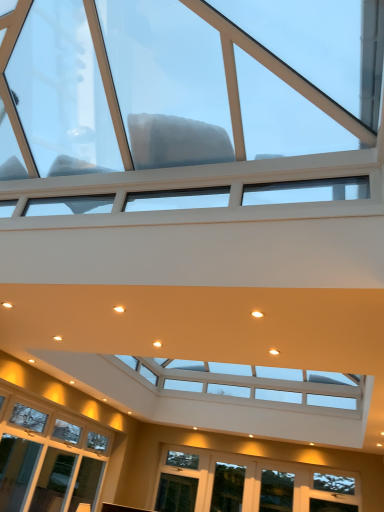
Question: Should I look upward or downward to see transparent glass window at upper center, which is counted as the 1th window, starting from the top?

Choices:
 (A) down
 (B) up

Answer: (B)

Question: Is transparent glass window at upper center, the third window from the back, positioned far away from clear glass window at lower center, which appears as the 2th window when ordered from the bottom?

Choices:
 (A) yes
 (B) no

Answer: (A)

Question: Is transparent glass window at upper center, the third window from the back, positioned with its back to clear glass window at lower center, which appears as the second window when viewed from the top?

Choices:
 (A) yes
 (B) no

Answer: (B)

Question: Does transparent glass window at upper center, which is counted as the 1th window, starting from the top, appear on the right side of clear glass window at lower center, the second window in the front-to-back sequence?

Choices:
 (A) no
 (B) yes

Answer: (A)

Question: Can you confirm if transparent glass window at upper center, which is counted as the 1th window, starting from the top, is bigger than clear glass window at lower center, which appears as the 2th window when ordered from the bottom?

Choices:
 (A) yes
 (B) no

Answer: (A)

Question: Is transparent glass window at upper center, which is counted as the 1th window, starting from the top, not inside clear glass window at lower center, the second window in the front-to-back sequence?

Choices:
 (A) yes
 (B) no

Answer: (A)

Question: Considering the relative sizes of transparent glass window at upper center, which is counted as the 1th window, starting from the top, and clear glass window at lower center, which appears as the 2th window when ordered from the bottom, in the image provided, is transparent glass window at upper center, which is counted as the 1th window, starting from the top, thinner than clear glass window at lower center, which appears as the 2th window when ordered from the bottom,?

Choices:
 (A) yes
 (B) no

Answer: (B)

Question: Can you confirm if clear glass window at lower center, which appears as the second window when viewed from the top, is positioned to the left of transparent glass window at upper center, marked as the 1th window in a front-to-back arrangement?

Choices:
 (A) no
 (B) yes

Answer: (A)

Question: Is clear glass window at lower center, which appears as the 2th window when ordered from the bottom, positioned beyond the bounds of transparent glass window at upper center, the third window from the back?

Choices:
 (A) yes
 (B) no

Answer: (A)

Question: From a real-world perspective, is clear glass window at lower center, the second window when ordered from back to front, below transparent glass window at upper center, marked as the 1th window in a front-to-back arrangement?

Choices:
 (A) no
 (B) yes

Answer: (B)

Question: Is clear glass window at lower center, the second window when ordered from back to front, at the right side of transparent glass window at upper center, which is counted as the 1th window, starting from the top?

Choices:
 (A) no
 (B) yes

Answer: (B)

Question: Is clear glass window at lower center, the second window in the front-to-back sequence, positioned before transparent glass window at upper center, the third window from the back?

Choices:
 (A) no
 (B) yes

Answer: (A)

Question: Can you confirm if clear glass window at lower center, the second window in the front-to-back sequence, is thinner than transparent glass window at upper center, marked as the 1th window in a front-to-back arrangement?

Choices:
 (A) no
 (B) yes

Answer: (B)

Question: Considering the relative positions of clear glass window at lower center, which appears as the second window when viewed from the top, and clear glass window at lower center, acting as the first window starting from the bottom, in the image provided, is clear glass window at lower center, which appears as the second window when viewed from the top, in front of clear glass window at lower center, acting as the first window starting from the bottom,?

Choices:
 (A) no
 (B) yes

Answer: (B)